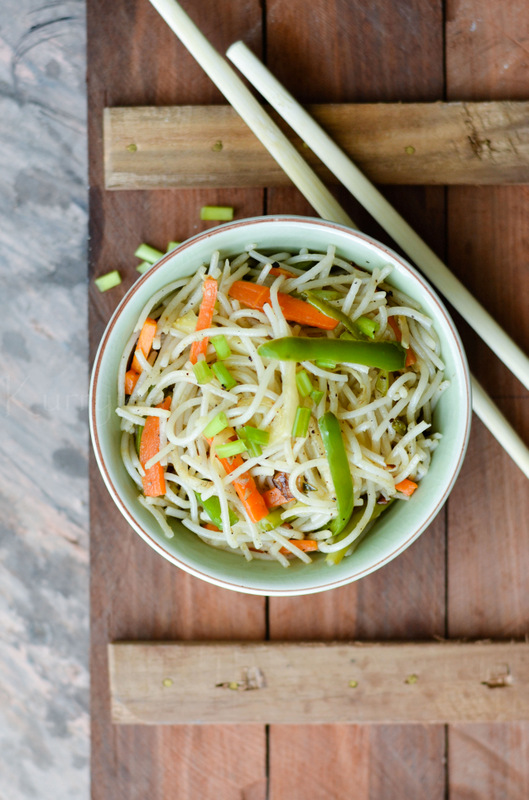
Locate an element on the screen. chopsticks is located at coordinates (463, 290), (510, 440).